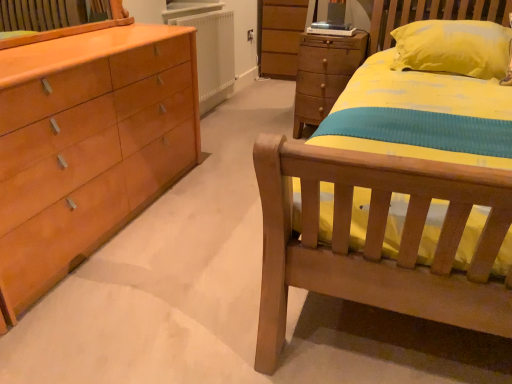
Question: Considering the positions of wooden chest of drawers at center and white matte radiator at center in the image, is wooden chest of drawers at center wider or thinner than white matte radiator at center?

Choices:
 (A) wide
 (B) thin

Answer: (A)

Question: Is wooden chest of drawers at center inside or outside of white matte radiator at center?

Choices:
 (A) inside
 (B) outside

Answer: (B)

Question: Is point (315, 94) closer or farther from the camera than point (181, 19)?

Choices:
 (A) farther
 (B) closer

Answer: (B)

Question: Visually, is white matte radiator at center positioned to the left or to the right of wooden chest of drawers at center?

Choices:
 (A) right
 (B) left

Answer: (B)

Question: From a real-world perspective, is white matte radiator at center positioned above or below wooden chest of drawers at center?

Choices:
 (A) below
 (B) above

Answer: (B)

Question: Choose the correct answer: Is white matte radiator at center inside wooden chest of drawers at center or outside it?

Choices:
 (A) inside
 (B) outside

Answer: (B)

Question: From the image's perspective, is white matte radiator at center located above or below wooden chest of drawers at center?

Choices:
 (A) below
 (B) above

Answer: (B)